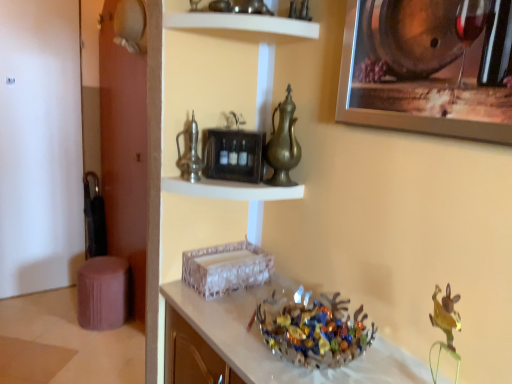
Question: Can you confirm if purple fabric stool at lower left is thinner than shiny metallic bowl at center?

Choices:
 (A) yes
 (B) no

Answer: (B)

Question: Is purple fabric stool at lower left not close to shiny metallic bowl at center?

Choices:
 (A) no
 (B) yes

Answer: (B)

Question: Would you say purple fabric stool at lower left is outside shiny metallic bowl at center?

Choices:
 (A) no
 (B) yes

Answer: (B)

Question: Is purple fabric stool at lower left positioned before shiny metallic bowl at center?

Choices:
 (A) yes
 (B) no

Answer: (B)

Question: Is purple fabric stool at lower left touching shiny metallic bowl at center?

Choices:
 (A) no
 (B) yes

Answer: (A)

Question: Is translucent glass bowl at center in front of or behind brass metallic pitcher at center in the image?

Choices:
 (A) behind
 (B) front

Answer: (B)

Question: Is translucent glass bowl at center to the left or to the right of brass metallic pitcher at center in the image?

Choices:
 (A) right
 (B) left

Answer: (B)

Question: Is point (229, 352) positioned closer to the camera than point (287, 134)?

Choices:
 (A) farther
 (B) closer

Answer: (B)

Question: Is translucent glass bowl at center bigger or smaller than brass metallic pitcher at center?

Choices:
 (A) big
 (B) small

Answer: (A)

Question: From their relative heights in the image, would you say brass metallic pitcher at center is taller or shorter than translucent glass bowl at center?

Choices:
 (A) short
 (B) tall

Answer: (A)

Question: From the image's perspective, is brass metallic pitcher at center above or below translucent glass bowl at center?

Choices:
 (A) above
 (B) below

Answer: (A)

Question: From a real-world perspective, relative to translucent glass bowl at center, is brass metallic pitcher at center vertically above or below?

Choices:
 (A) above
 (B) below

Answer: (A)

Question: Is brass metallic pitcher at center in front of or behind translucent glass bowl at center in the image?

Choices:
 (A) behind
 (B) front

Answer: (A)

Question: In terms of height, does brass metallic pitcher at center look taller or shorter compared to white glossy shelf at upper center, which is counted as the 2th shelf, starting from the bottom?

Choices:
 (A) short
 (B) tall

Answer: (B)

Question: Looking at their shapes, would you say brass metallic pitcher at center is wider or thinner than white glossy shelf at upper center, which is counted as the 2th shelf, starting from the bottom?

Choices:
 (A) wide
 (B) thin

Answer: (B)